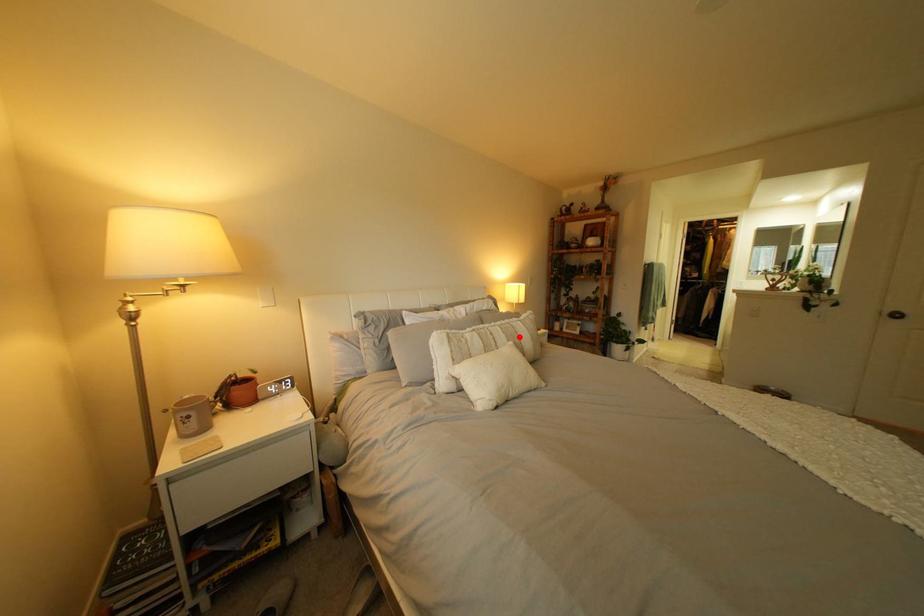
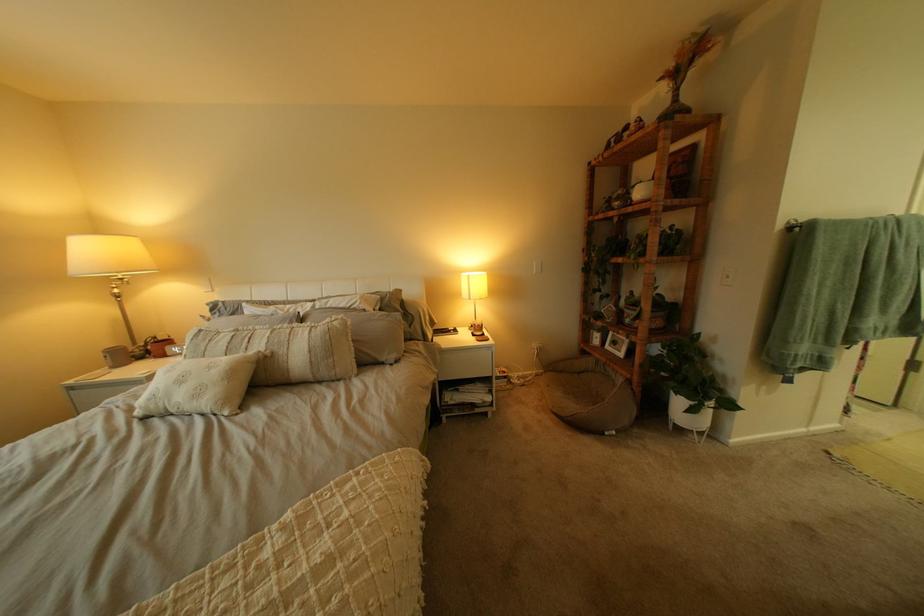
In the second image, find the point that corresponds to the highlighted location in the first image.

(281, 342)